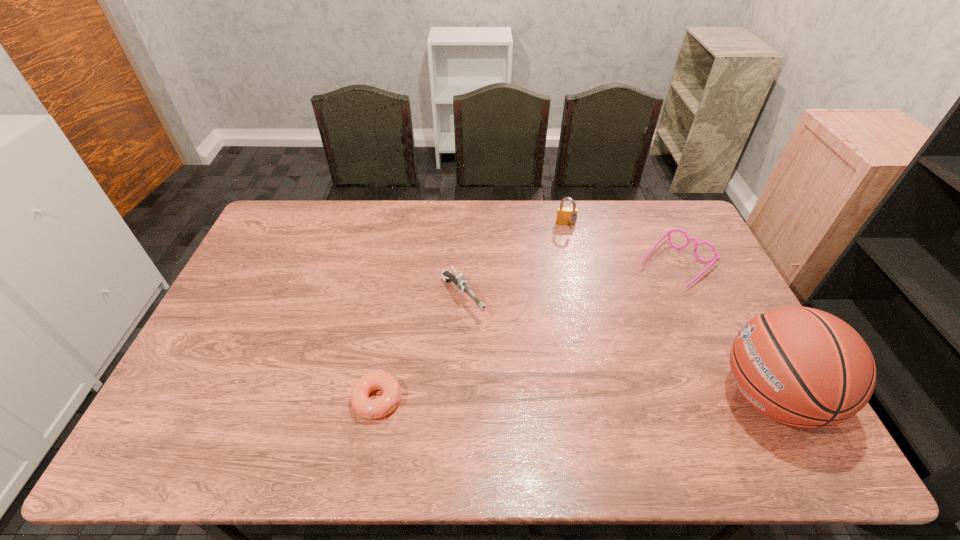
Identify the location of vacant space that satisfies the following two spatial constraints: 1. on the back side of the shortest object; 2. on the logo side of the basketball. Image resolution: width=960 pixels, height=540 pixels. (378, 396).